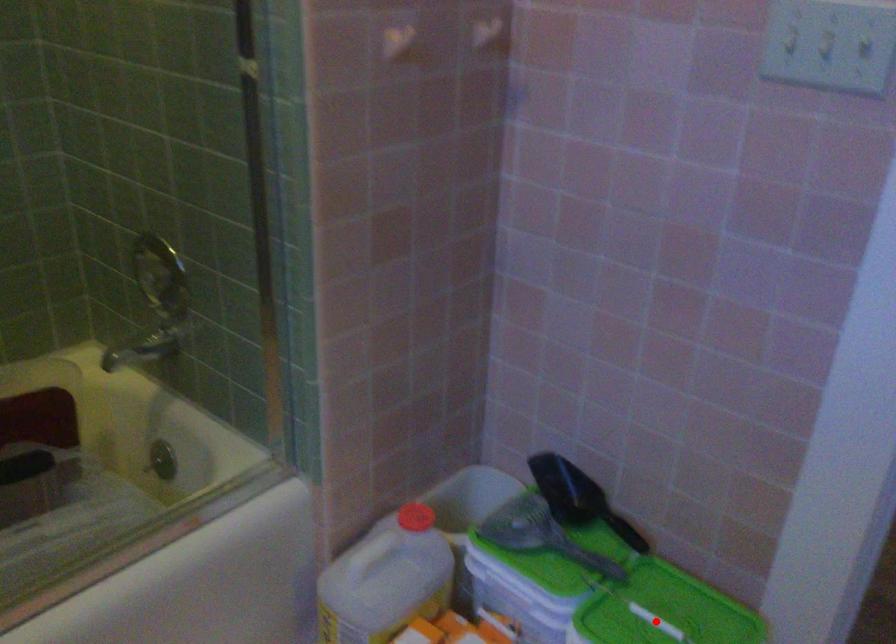
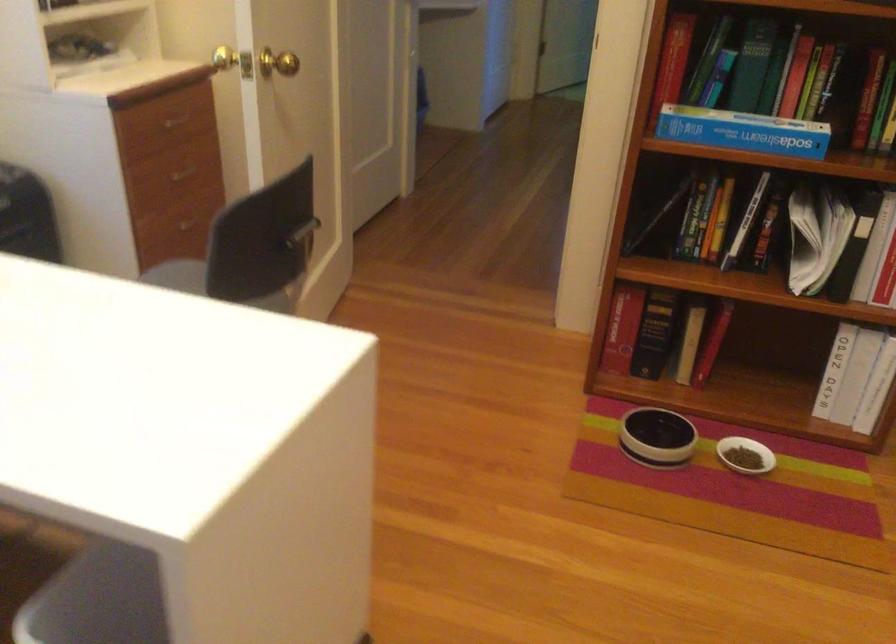
Question: I am providing you with two images of the same scene from different viewpoints. A red point is marked on the first image. At the location where the point appears in image 1, is it still visible in image 2?

Choices:
 (A) Yes
 (B) No

Answer: (B)